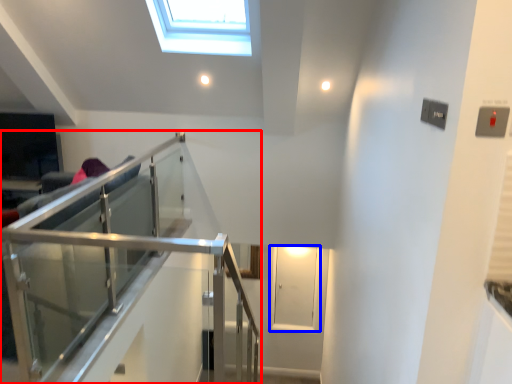
Question: Among these objects, which one is farthest to the camera, balcony (highlighted by a red box) or glass door (highlighted by a blue box)?

Choices:
 (A) balcony
 (B) glass door

Answer: (B)